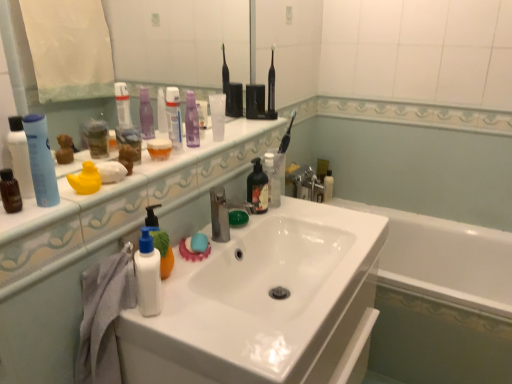
Locate an element on the screen. vacant space behind translucent plastic mouthwash at center, marked as the third mouthwash in a left-to-right arrangement is located at coordinates (201, 143).